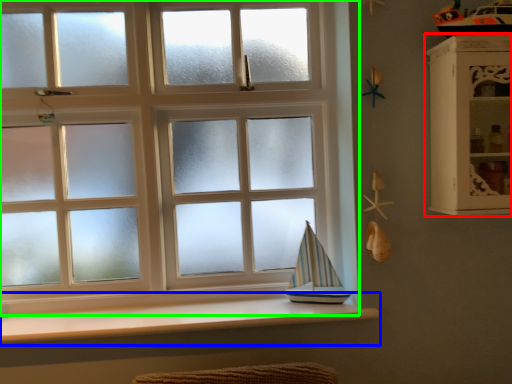
Question: Which object is the closest to the shelf (highlighted by a red box)? Choose among these: window sill (highlighted by a blue box) or window (highlighted by a green box).

Choices:
 (A) window sill
 (B) window

Answer: (A)